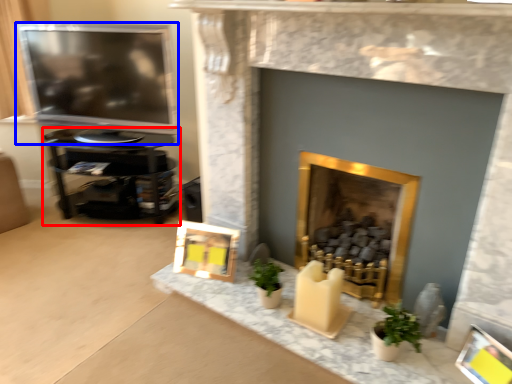
Question: Which object is further to the camera taking this photo, furniture (highlighted by a red box) or television (highlighted by a blue box)?

Choices:
 (A) furniture
 (B) television

Answer: (A)